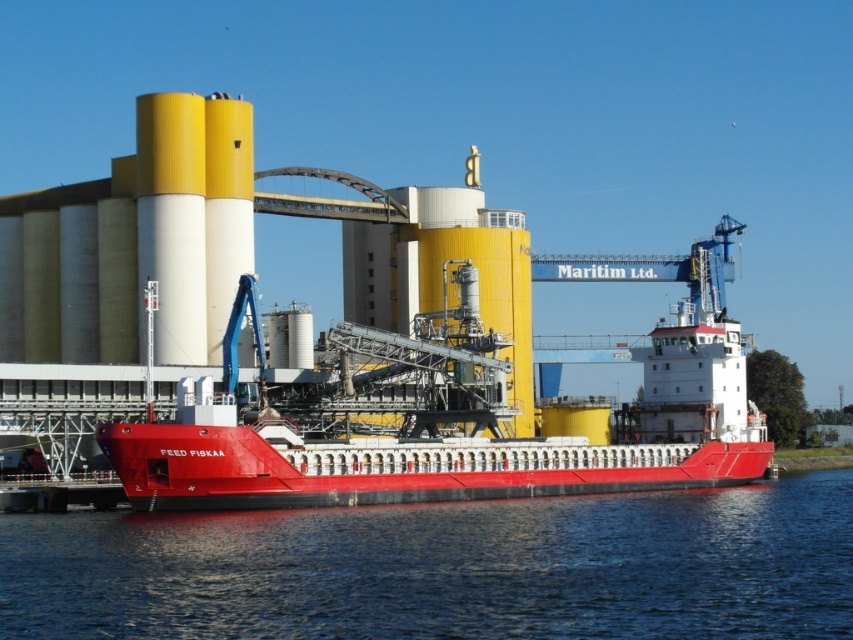
Question: Which of the following is the closest to the observer?

Choices:
 (A) metallic red barge at center
 (B) transparent blue water at lower center

Answer: (B)

Question: Which point is closer to the camera?

Choices:
 (A) (662, 618)
 (B) (427, 429)

Answer: (A)

Question: Which point is farther to the camera?

Choices:
 (A) transparent blue water at lower center
 (B) metallic red barge at center

Answer: (B)

Question: Is transparent blue water at lower center closer to camera compared to metallic red barge at center?

Choices:
 (A) yes
 (B) no

Answer: (A)

Question: Does transparent blue water at lower center appear on the left side of metallic red barge at center?

Choices:
 (A) yes
 (B) no

Answer: (A)

Question: Is transparent blue water at lower center to the right of metallic red barge at center from the viewer's perspective?

Choices:
 (A) yes
 (B) no

Answer: (B)